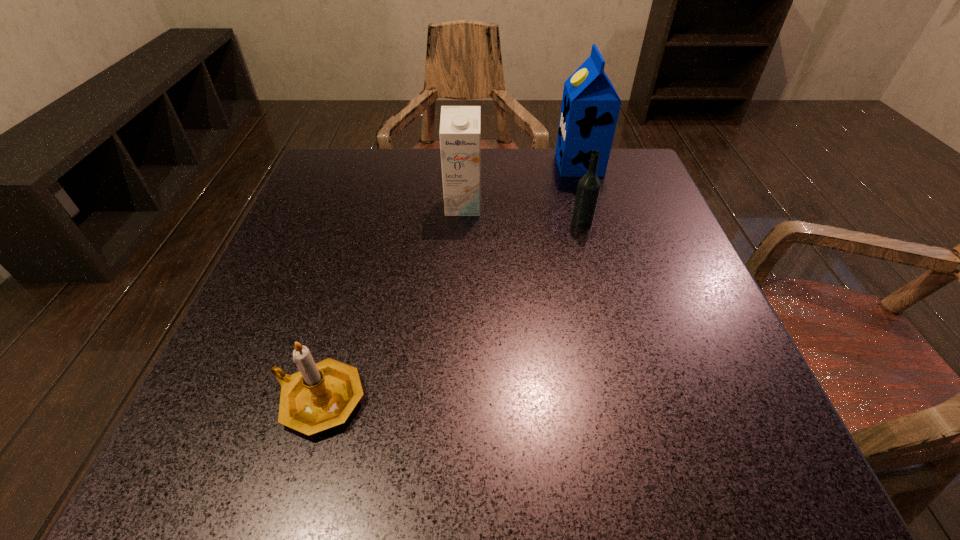
Where is `the tallest object`? Image resolution: width=960 pixels, height=540 pixels. the tallest object is located at coordinates (590, 107).

Identify the location of the farthest object. (590, 107).

Identify the location of the shorter carton. (460, 126).

At what (x,y) coordinates should I click in order to perform the action: click on the third object from right to left. Please return your answer as a coordinate pair (x, y). Looking at the image, I should click on (460, 126).

Where is `vodka`? vodka is located at coordinates (589, 186).

I want to click on the nearest object, so click(320, 396).

In order to click on the leftmost object in this screenshot , I will do `click(320, 396)`.

The width and height of the screenshot is (960, 540). What are the coordinates of `vacant space situated 0.190m with the cap open on the taller carton` in the screenshot? It's located at (480, 165).

Locate an element on the screen. The width and height of the screenshot is (960, 540). free space located 0.360m with the cap open on the taller carton is located at coordinates (411, 165).

This screenshot has width=960, height=540. I want to click on vacant region located with the cap open on the taller carton, so click(464, 165).